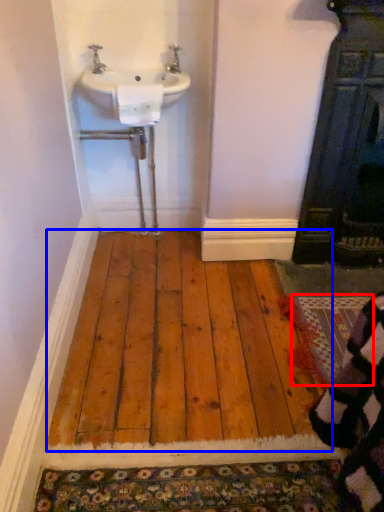
Question: Which object appears closest to the camera in this image, doormat (highlighted by a red box) or hardwood (highlighted by a blue box)?

Choices:
 (A) doormat
 (B) hardwood

Answer: (B)